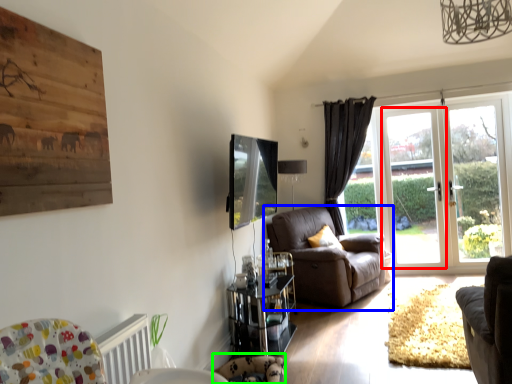
Question: Considering the real-world distances, which object is farthest from screen door (highlighted by a red box)? chair (highlighted by a blue box) or swivel chair (highlighted by a green box)?

Choices:
 (A) chair
 (B) swivel chair

Answer: (B)